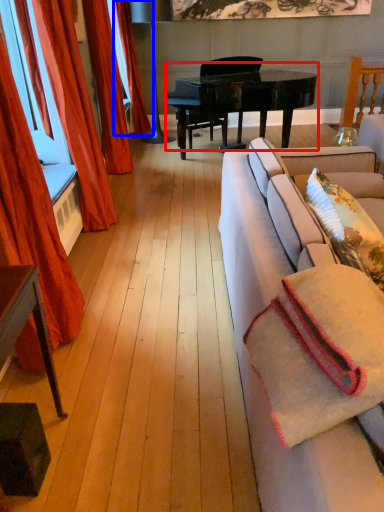
Question: Which object is closer to the camera taking this photo, piano (highlighted by a red box) or curtain (highlighted by a blue box)?

Choices:
 (A) piano
 (B) curtain

Answer: (A)